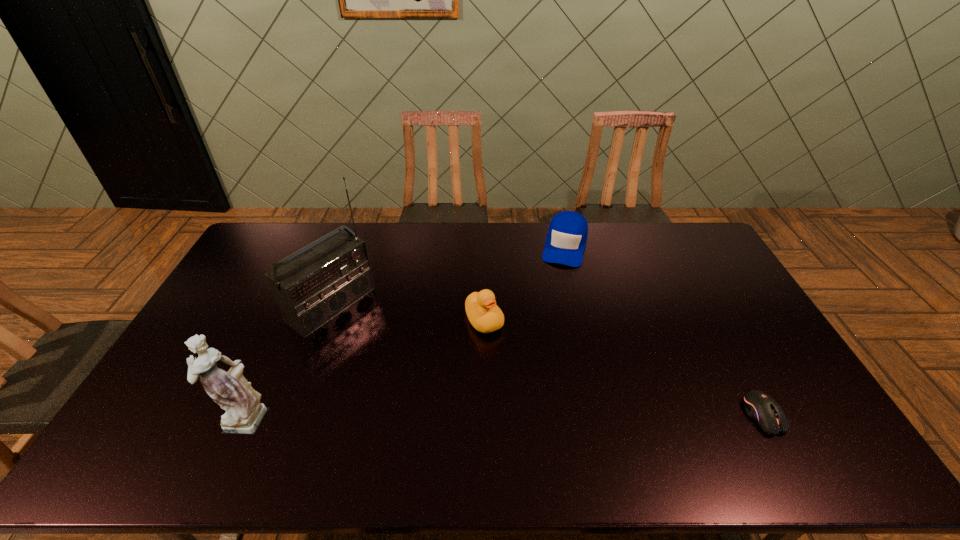
Locate an element on the screen. The width and height of the screenshot is (960, 540). vacant space at the near right corner of the desktop is located at coordinates (797, 428).

Image resolution: width=960 pixels, height=540 pixels. I want to click on vacant area that lies between the third object from left to right and the radio receiver, so click(408, 313).

Identify the location of free area in between the computer mouse and the third tallest object. (623, 368).

In order to click on unoccupied area between the third object from right to left and the tallest object in this screenshot , I will do `click(408, 313)`.

Where is `empty space that is in between the radio receiver and the fourth shortest object`? The height and width of the screenshot is (540, 960). empty space that is in between the radio receiver and the fourth shortest object is located at coordinates (287, 360).

Locate an element on the screen. free spot between the tallest object and the duck is located at coordinates (408, 313).

At what (x,y) coordinates should I click in order to perform the action: click on free spot between the third object from left to right and the second tallest object. Please return your answer as a coordinate pair (x, y). Looking at the image, I should click on (364, 368).

I want to click on free point between the third shortest object and the tallest object, so click(408, 313).

Image resolution: width=960 pixels, height=540 pixels. What are the coordinates of `free area in between the computer mouse and the figurine` in the screenshot? It's located at (503, 416).

Identify the location of free spot between the second object from right to left and the figurine. This screenshot has width=960, height=540. (404, 330).